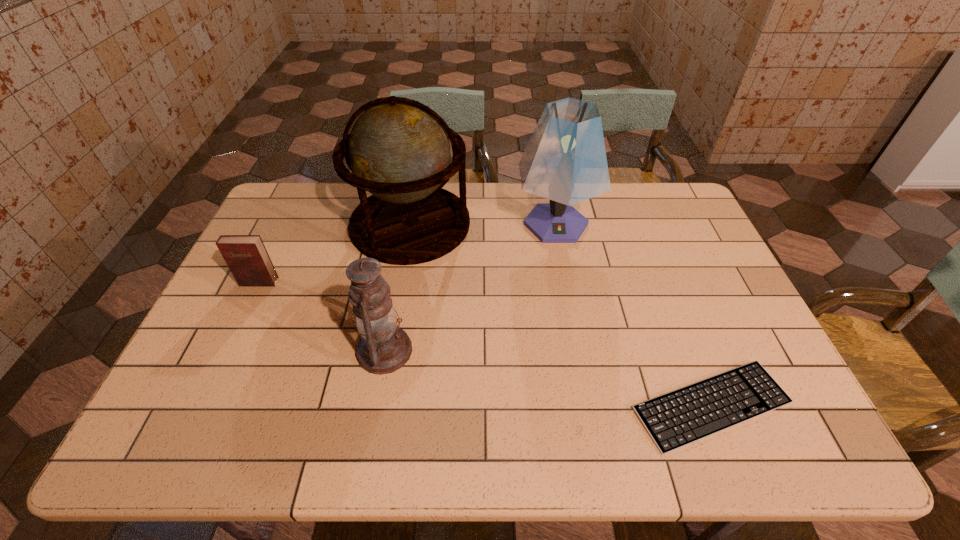
Where is `free location located on the left of the computer keyboard`? The width and height of the screenshot is (960, 540). free location located on the left of the computer keyboard is located at coordinates (516, 406).

Where is `globe positioned at the far edge`? This screenshot has height=540, width=960. globe positioned at the far edge is located at coordinates (398, 150).

The height and width of the screenshot is (540, 960). What are the coordinates of `lampshade that is at the far edge` in the screenshot? It's located at (565, 161).

In order to click on object at the near edge in this screenshot , I will do `click(681, 417)`.

At what (x,y) coordinates should I click in order to perform the action: click on object located at the left edge. Please return your answer as a coordinate pair (x, y). Looking at the image, I should click on (246, 256).

Where is `object at the right edge`? object at the right edge is located at coordinates (681, 417).

You are a GUI agent. You are given a task and a screenshot of the screen. Output one action in this format:
    pyautogui.click(x=<x>, y=<y>)
    Task: Click on the object positioned at the near right corner
    
    Given the screenshot: What is the action you would take?
    pyautogui.click(x=681, y=417)

Find the location of a particular element. vacant space at the far edge is located at coordinates (618, 192).

The height and width of the screenshot is (540, 960). What are the coordinates of `vacant area at the near edge of the desktop` in the screenshot? It's located at (296, 420).

Locate an element on the screen. This screenshot has width=960, height=540. free space at the left edge of the desktop is located at coordinates (280, 238).